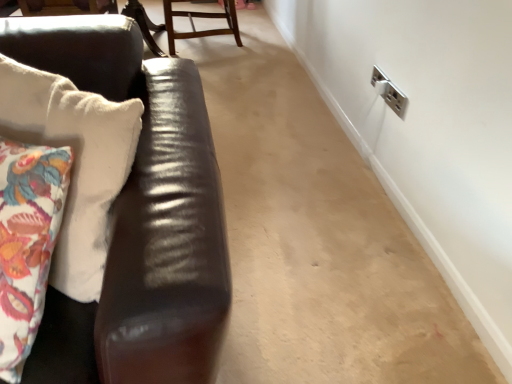
Question: From the image's perspective, is wooden chair at upper center beneath shiny brown leather couch at left?

Choices:
 (A) no
 (B) yes

Answer: (A)

Question: Are wooden chair at upper center and shiny brown leather couch at left making contact?

Choices:
 (A) no
 (B) yes

Answer: (A)

Question: Does wooden chair at upper center have a greater width compared to shiny brown leather couch at left?

Choices:
 (A) no
 (B) yes

Answer: (A)

Question: Does wooden chair at upper center have a lesser height compared to shiny brown leather couch at left?

Choices:
 (A) yes
 (B) no

Answer: (A)

Question: Does wooden chair at upper center come in front of shiny brown leather couch at left?

Choices:
 (A) no
 (B) yes

Answer: (A)

Question: Would you say shiny brown leather couch at left is part of wooden chair at upper center's contents?

Choices:
 (A) no
 (B) yes

Answer: (A)

Question: From the image's perspective, would you say shiny brown leather couch at left is shown under wooden chair at upper center?

Choices:
 (A) no
 (B) yes

Answer: (B)

Question: From the image's perspective, does shiny brown leather couch at left appear higher than wooden chair at upper center?

Choices:
 (A) yes
 (B) no

Answer: (B)

Question: Is shiny brown leather couch at left not inside wooden chair at upper center?

Choices:
 (A) yes
 (B) no

Answer: (A)

Question: Is shiny brown leather couch at left at the right side of wooden chair at upper center?

Choices:
 (A) yes
 (B) no

Answer: (B)

Question: Considering the relative sizes of shiny brown leather couch at left and wooden chair at upper center in the image provided, is shiny brown leather couch at left shorter than wooden chair at upper center?

Choices:
 (A) yes
 (B) no

Answer: (B)

Question: From a real-world perspective, is shiny brown leather couch at left over wooden chair at upper center?

Choices:
 (A) yes
 (B) no

Answer: (A)

Question: Based on their positions, is shiny brown leather couch at left located to the left or right of wooden chair at upper center?

Choices:
 (A) left
 (B) right

Answer: (A)